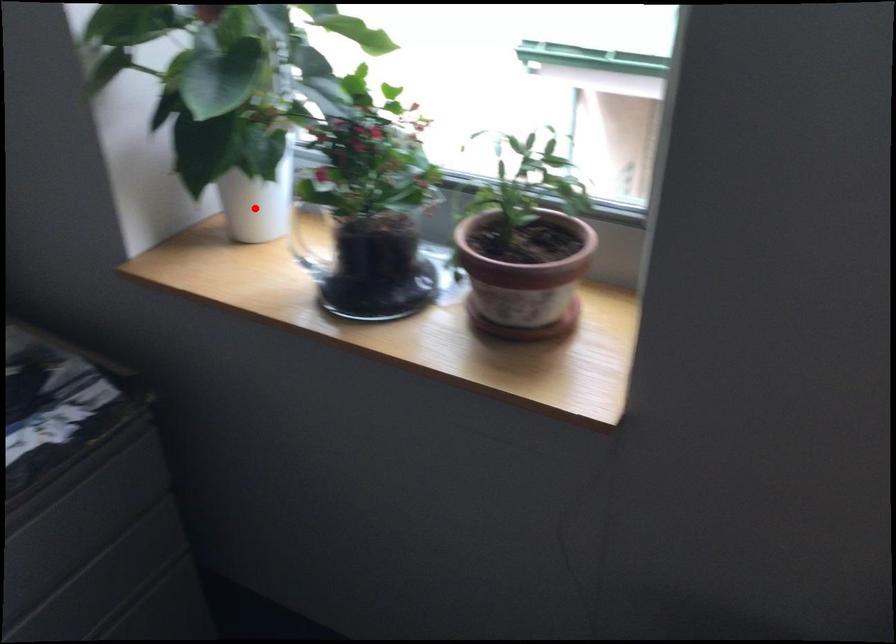
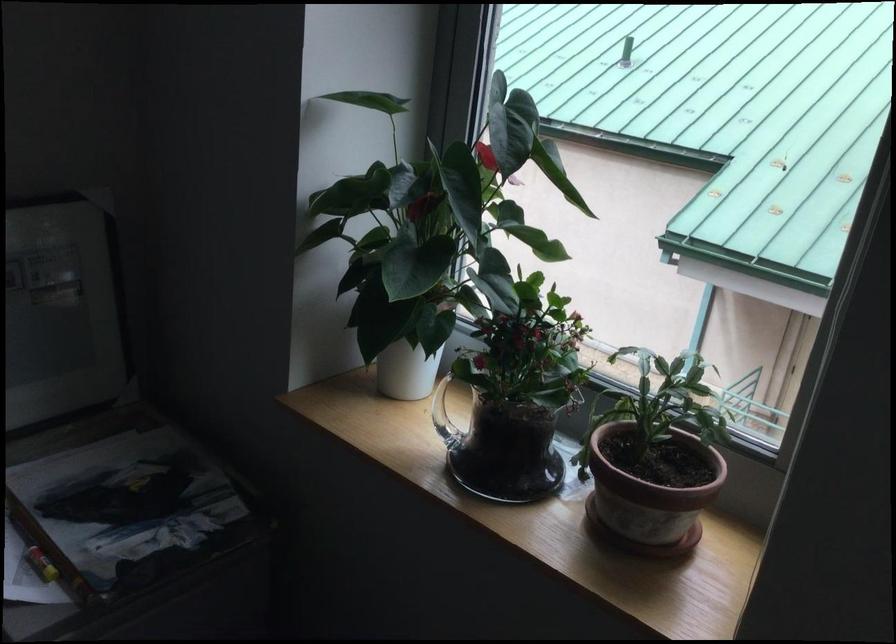
Find the pixel in the second image that matches the highlighted location in the first image.

(407, 368)